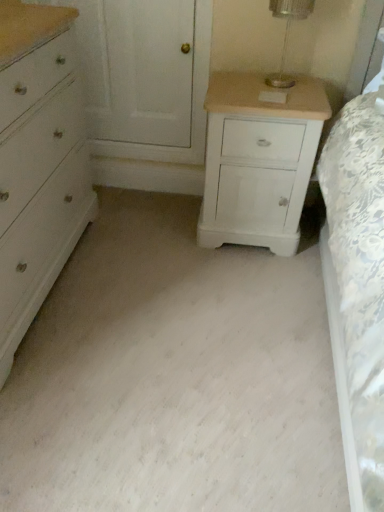
Image resolution: width=384 pixels, height=512 pixels. Find the location of `clear glass table lamp at upper center`. clear glass table lamp at upper center is located at coordinates (287, 34).

Where is `white painted wood chest of drawers at left`? The image size is (384, 512). white painted wood chest of drawers at left is located at coordinates (38, 162).

You are a GUI agent. You are given a task and a screenshot of the screen. Output one action in this format:
    pyautogui.click(x=<x>, y=<y>)
    Task: Click on the white painted wood nightstand at right
    The width and height of the screenshot is (384, 512).
    Given the screenshot: What is the action you would take?
    pyautogui.click(x=259, y=160)

Would you say white painted wood nightstand at right is inside or outside clear glass table lamp at upper center?

white painted wood nightstand at right is outside clear glass table lamp at upper center.

From the image's perspective, which object appears higher, white painted wood nightstand at right or clear glass table lamp at upper center?

clear glass table lamp at upper center, from the image's perspective.

Who is smaller, white painted wood nightstand at right or clear glass table lamp at upper center?

With smaller size is clear glass table lamp at upper center.

How many degrees apart are the facing directions of white painted wood nightstand at right and clear glass table lamp at upper center?

0.000355 degrees.

Which object is further away from the camera taking this photo, white painted wood nightstand at right or white painted wood chest of drawers at left?

white painted wood nightstand at right is further away from the camera.

Would you say white painted wood nightstand at right is a long distance from white painted wood chest of drawers at left?

Actually, white painted wood nightstand at right and white painted wood chest of drawers at left are a little close together.

Considering the relative sizes of white painted wood nightstand at right and white painted wood chest of drawers at left in the image provided, is white painted wood nightstand at right bigger than white painted wood chest of drawers at left?

No, white painted wood nightstand at right is not bigger than white painted wood chest of drawers at left.

From the picture: From the image's perspective, relative to white painted wood chest of drawers at left, is white painted wood nightstand at right above or below?

white painted wood nightstand at right is above white painted wood chest of drawers at left.

Is white painted wood chest of drawers at left oriented away from white painted wood nightstand at right?

white painted wood chest of drawers at left does not have its back to white painted wood nightstand at right.

From the image's perspective, is white painted wood chest of drawers at left located above white painted wood nightstand at right?

Incorrect, from the image's perspective, white painted wood chest of drawers at left is lower than white painted wood nightstand at right.

Does white painted wood chest of drawers at left come behind white painted wood nightstand at right?

No.

Can you confirm if white painted wood chest of drawers at left is wider than white painted wood nightstand at right?

Yes, white painted wood chest of drawers at left is wider than white painted wood nightstand at right.

Identify the location of nightstand beneath the clear glass table lamp at upper center (from a real-world perspective). (259, 160).

Between clear glass table lamp at upper center and white painted wood nightstand at right, which one has smaller size?

With smaller size is clear glass table lamp at upper center.

Is clear glass table lamp at upper center not close to white painted wood nightstand at right?

clear glass table lamp at upper center is actually quite close to white painted wood nightstand at right.

Is clear glass table lamp at upper center located outside white painted wood nightstand at right?

clear glass table lamp at upper center is positioned outside white painted wood nightstand at right.

You are a GUI agent. You are given a task and a screenshot of the screen. Output one action in this format:
    pyautogui.click(x=<x>, y=<y>)
    Task: Click on the table lamp behind the white painted wood chest of drawers at left
    
    Given the screenshot: What is the action you would take?
    pyautogui.click(x=287, y=34)

Considering the relative positions of clear glass table lamp at upper center and white painted wood chest of drawers at left in the image provided, is clear glass table lamp at upper center to the left of white painted wood chest of drawers at left from the viewer's perspective?

No.

Does clear glass table lamp at upper center touch white painted wood chest of drawers at left?

No, clear glass table lamp at upper center is not with white painted wood chest of drawers at left.

What's the angular difference between clear glass table lamp at upper center and white painted wood chest of drawers at left's facing directions?

The angle between the facing direction of clear glass table lamp at upper center and the facing direction of white painted wood chest of drawers at left is 89 degrees.

From the image's perspective, which is below, white painted wood chest of drawers at left or clear glass table lamp at upper center?

white painted wood chest of drawers at left is shown below in the image.

Can you confirm if white painted wood chest of drawers at left is taller than clear glass table lamp at upper center?

Yes, white painted wood chest of drawers at left is taller than clear glass table lamp at upper center.

Considering the relative sizes of white painted wood chest of drawers at left and clear glass table lamp at upper center in the image provided, is white painted wood chest of drawers at left thinner than clear glass table lamp at upper center?

Incorrect, the width of white painted wood chest of drawers at left is not less than that of clear glass table lamp at upper center.

Is the depth of white painted wood chest of drawers at left greater than that of clear glass table lamp at upper center?

No, it is not.

The image size is (384, 512). I want to click on nightstand to the left of clear glass table lamp at upper center, so [259, 160].

Identify the location of the chest of drawers above the white painted wood nightstand at right (from a real-world perspective). This screenshot has width=384, height=512. (38, 162).

From the image, which object appears to be farther from white painted wood nightstand at right, clear glass table lamp at upper center or white painted wood chest of drawers at left?

white painted wood chest of drawers at left is positioned further to the anchor white painted wood nightstand at right.

Based on their spatial positions, is clear glass table lamp at upper center or white painted wood nightstand at right further from white painted wood chest of drawers at left?

clear glass table lamp at upper center.

Looking at this image, which object lies further to the anchor point white painted wood nightstand at right, white painted wood chest of drawers at left or clear glass table lamp at upper center?

white painted wood chest of drawers at left is positioned further to the anchor white painted wood nightstand at right.

Looking at the image, which one is located closer to white painted wood chest of drawers at left, white painted wood nightstand at right or clear glass table lamp at upper center?

white painted wood nightstand at right is closer to white painted wood chest of drawers at left.

When comparing their distances from clear glass table lamp at upper center, does white painted wood chest of drawers at left or white painted wood nightstand at right seem further?

white painted wood chest of drawers at left is further to clear glass table lamp at upper center.

When comparing their distances from clear glass table lamp at upper center, does white painted wood nightstand at right or white painted wood chest of drawers at left seem further?

The object further to clear glass table lamp at upper center is white painted wood chest of drawers at left.

You are a GUI agent. You are given a task and a screenshot of the screen. Output one action in this format:
    pyautogui.click(x=<x>, y=<y>)
    Task: Click on the nightstand situated between white painted wood chest of drawers at left and clear glass table lamp at upper center from left to right
    
    Given the screenshot: What is the action you would take?
    pyautogui.click(x=259, y=160)